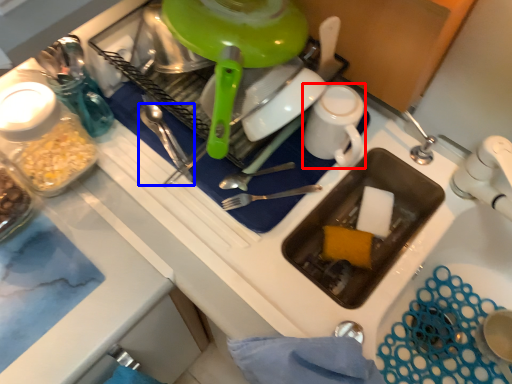
Question: Which point is closer to the camera, tableware (highlighted by a red box) or silverware (highlighted by a blue box)?

Choices:
 (A) tableware
 (B) silverware

Answer: (A)